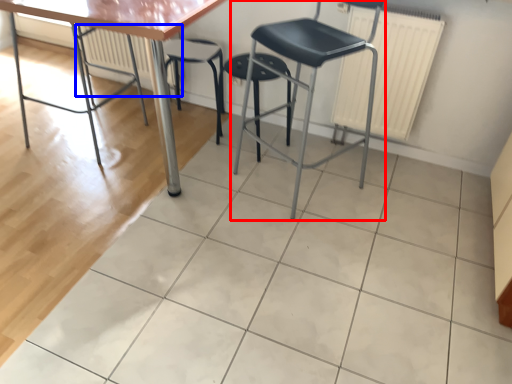
Question: Which point is closer to the camera, chair (highlighted by a red box) or radiator (highlighted by a blue box)?

Choices:
 (A) chair
 (B) radiator

Answer: (A)